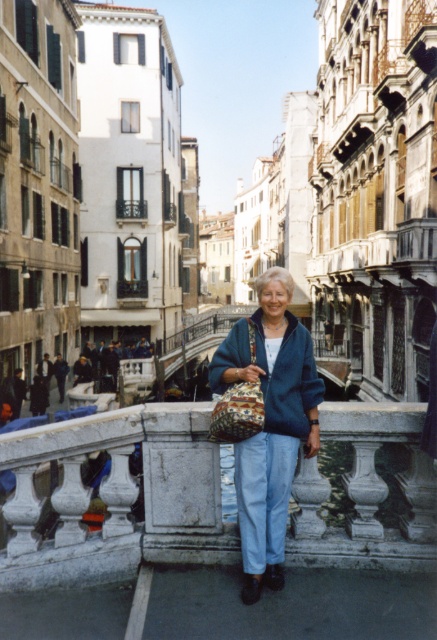
Question: Does white marble railing at center have a lesser width compared to denim jacket at center?

Choices:
 (A) no
 (B) yes

Answer: (A)

Question: Considering the relative positions of denim jacket at center and blue woolen cardigan at center in the image provided, where is denim jacket at center located with respect to blue woolen cardigan at center?

Choices:
 (A) above
 (B) below

Answer: (B)

Question: Can you confirm if denim jacket at center is thinner than blue woolen cardigan at center?

Choices:
 (A) no
 (B) yes

Answer: (B)

Question: Which object is positioned farthest from the white marble railing at center?

Choices:
 (A) denim jacket at center
 (B) blue woolen cardigan at center

Answer: (B)

Question: Estimate the real-world distances between objects in this image. Which object is closer to the denim jacket at center?

Choices:
 (A) blue woolen cardigan at center
 (B) white marble railing at center

Answer: (A)

Question: Among these points, which one is nearest to the camera?

Choices:
 (A) pyautogui.click(x=301, y=420)
 (B) pyautogui.click(x=255, y=358)
 (C) pyautogui.click(x=170, y=442)

Answer: (C)